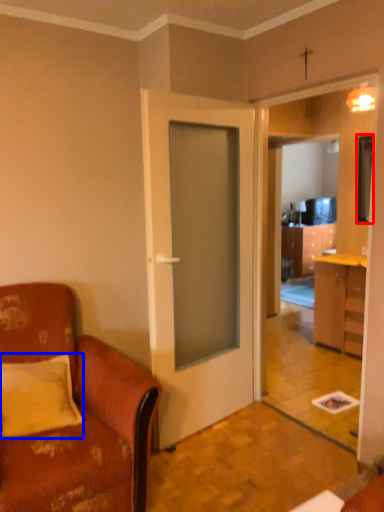
Question: Which point is closer to the camera, television (highlighted by a red box) or pillow (highlighted by a blue box)?

Choices:
 (A) television
 (B) pillow

Answer: (B)